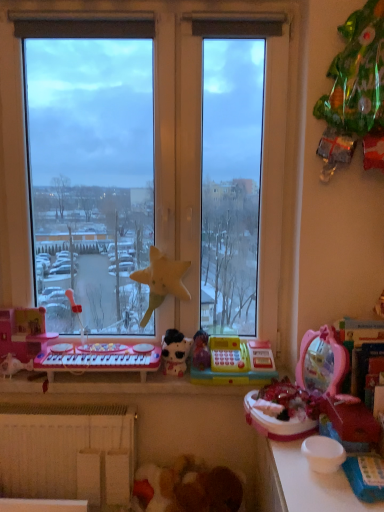
Identify the location of vacant space to the left of blue plastic toy at lower right, which is the seventh toy from left to right. (310, 482).